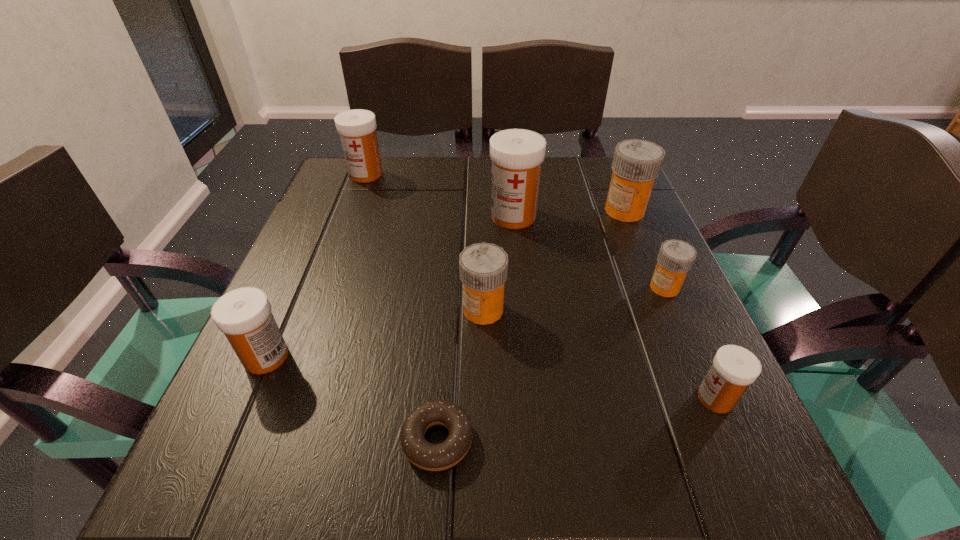
The width and height of the screenshot is (960, 540). I want to click on vacant region at the far edge of the desktop, so click(398, 191).

Find the location of a particular element. free space at the near edge of the desktop is located at coordinates (397, 474).

This screenshot has height=540, width=960. I want to click on free space at the left edge, so click(344, 237).

Locate an element on the screen. The image size is (960, 540). free space at the right edge of the desktop is located at coordinates (652, 225).

The height and width of the screenshot is (540, 960). Find the location of `free space at the far right corner`. free space at the far right corner is located at coordinates (593, 168).

Where is `free space between the leftmost orange medicine and the smallest orange medicine`? Image resolution: width=960 pixels, height=540 pixels. free space between the leftmost orange medicine and the smallest orange medicine is located at coordinates (574, 299).

Find the location of `unoccupied area between the farthest medicine and the smallest orange medicine`. unoccupied area between the farthest medicine and the smallest orange medicine is located at coordinates (516, 231).

This screenshot has width=960, height=540. What are the coordinates of `free space between the sixth farthest object and the farthest orange medicine` in the screenshot? It's located at (445, 284).

Locate an element on the screen. The image size is (960, 540). free space between the leftmost orange medicine and the sixth farthest medicine is located at coordinates (374, 333).

This screenshot has width=960, height=540. In order to click on free spot between the nearest medicine and the second smallest orange medicine in this screenshot , I will do `click(599, 354)`.